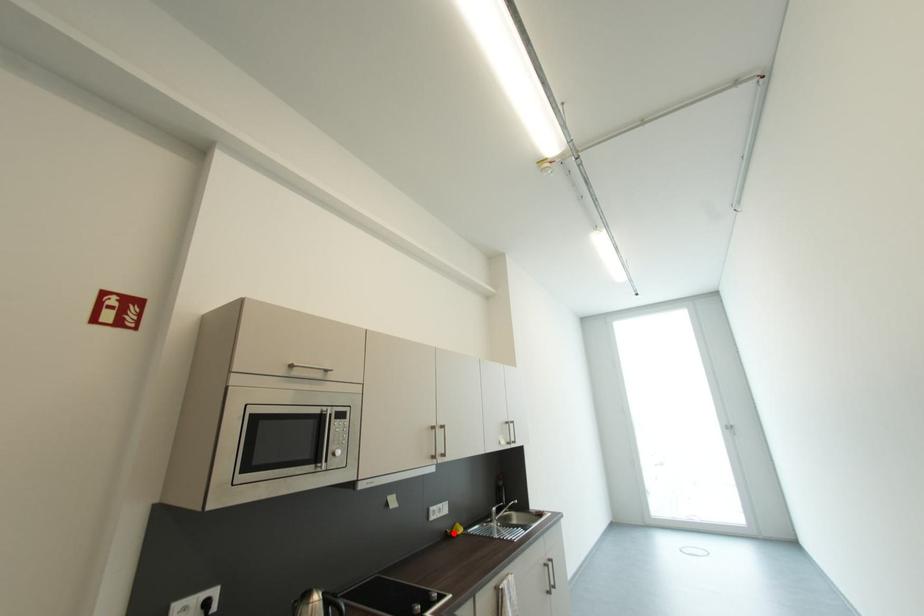
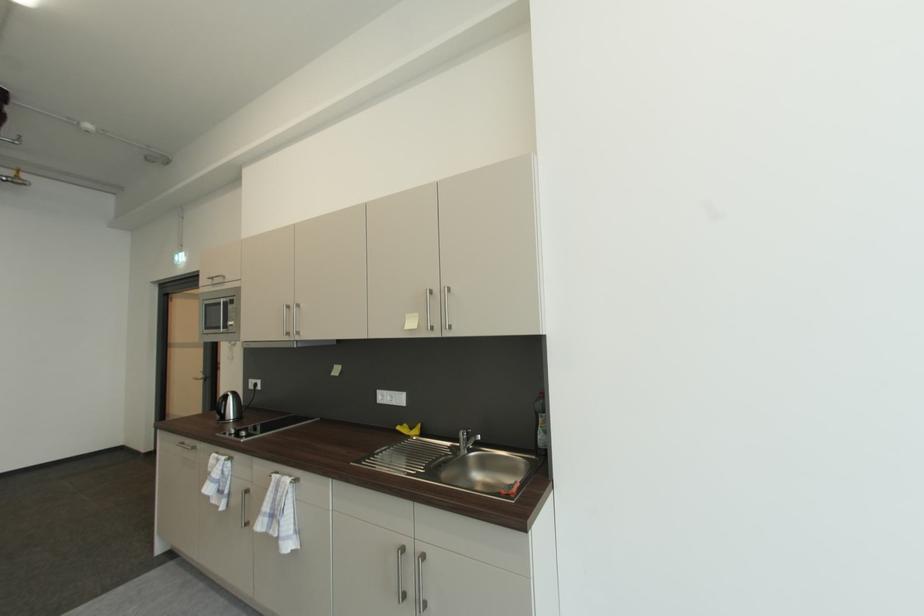
The point at the highlighted location is marked in the first image. Where is the corresponding point in the second image?

(408, 427)